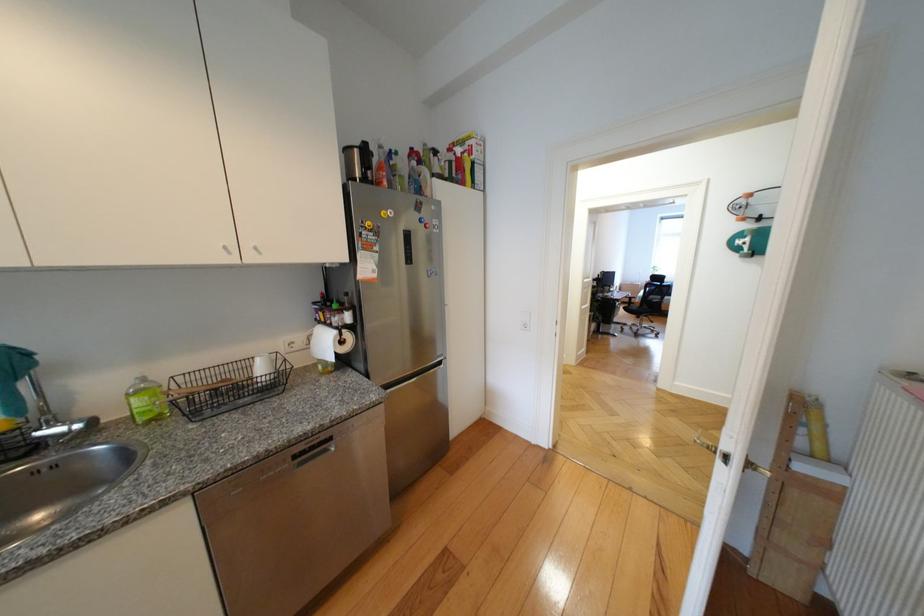
Where would you push the light switch? Please return your answer as a coordinate pair (x, y).

(525, 321)